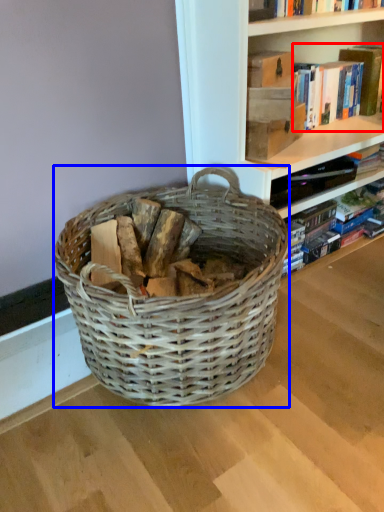
Question: Among these objects, which one is farthest to the camera, book (highlighted by a red box) or picnic basket (highlighted by a blue box)?

Choices:
 (A) book
 (B) picnic basket

Answer: (A)